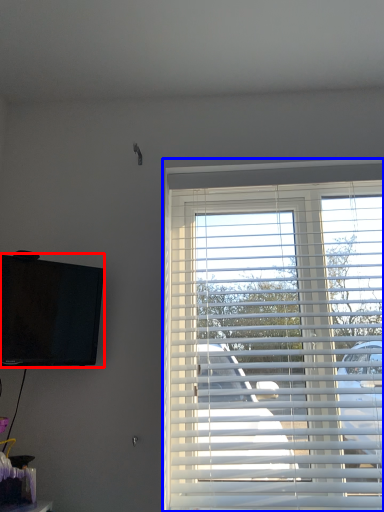
Question: Which object is closer to the camera taking this photo, television (highlighted by a red box) or window blind (highlighted by a blue box)?

Choices:
 (A) television
 (B) window blind

Answer: (A)